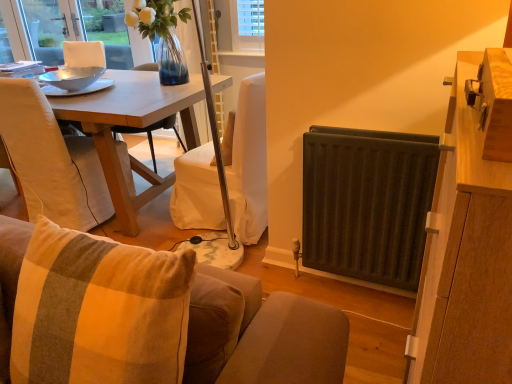
Question: Does point (364, 170) appear closer or farther from the camera than point (231, 296)?

Choices:
 (A) farther
 (B) closer

Answer: (A)

Question: Is dark gray metal radiator at right inside the boundaries of plush fabric couch at lower center, or outside?

Choices:
 (A) outside
 (B) inside

Answer: (A)

Question: Which object is positioned closest to the wooden cabinet at right?

Choices:
 (A) dark gray metal radiator at right
 (B) wooden table at center
 (C) plush fabric couch at lower center
 (D) beige fabric chair at left

Answer: (C)

Question: Which is farther from the wooden table at center?

Choices:
 (A) dark gray metal radiator at right
 (B) beige fabric chair at left
 (C) plush fabric couch at lower center
 (D) wooden cabinet at right

Answer: (D)